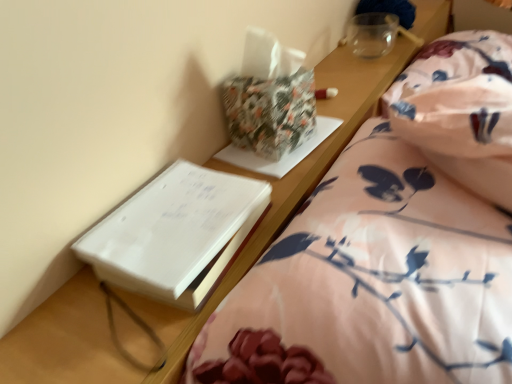
Question: Is point (197, 296) closer or farther from the camera than point (261, 153)?

Choices:
 (A) closer
 (B) farther

Answer: (A)

Question: Relative to floral-patterned paper at upper center, is white paper at left in front or behind?

Choices:
 (A) front
 (B) behind

Answer: (A)

Question: Based on their relative distances, which object is farther from the white paper at left?

Choices:
 (A) floral-patterned paper at upper center
 (B) floral fabric bed at lower right
 (C) floral cotton blanket at right

Answer: (C)

Question: Which object is positioned farthest from the floral-patterned paper at upper center?

Choices:
 (A) white paper at left
 (B) floral fabric bed at lower right
 (C) floral cotton blanket at right

Answer: (C)